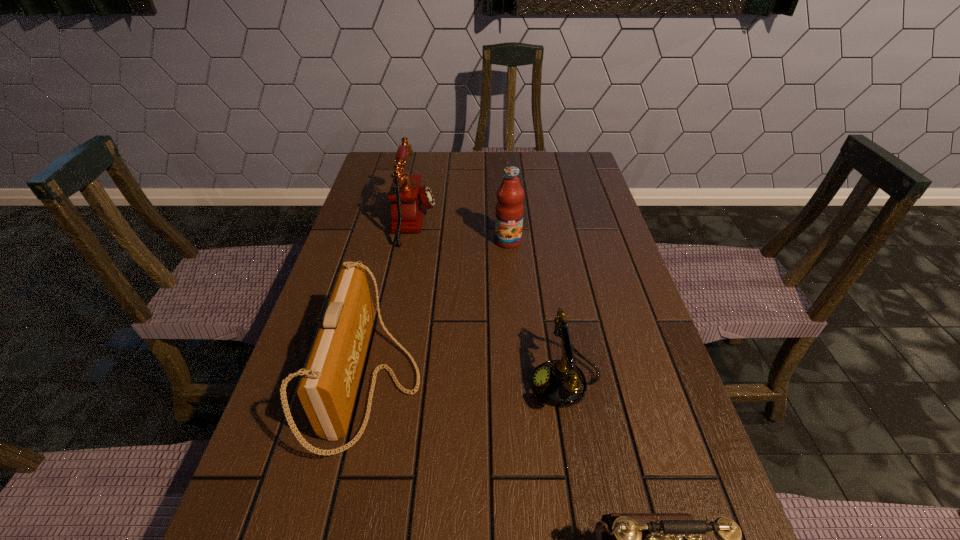
Locate an element on the screen. The height and width of the screenshot is (540, 960). vacant point located between the second farthest telephone and the farthest telephone is located at coordinates (490, 302).

The image size is (960, 540). I want to click on free point between the handbag and the second nearest telephone, so click(x=468, y=382).

Identify which object is located as the nearest to the second nearest telephone. Please provide its 2D coordinates. Your answer should be formatted as a tuple, i.e. [(x, y)], where the tuple contains the x and y coordinates of a point satisfying the conditions above.

[(635, 539)]

Identify which object is located as the second nearest to the nearest telephone. Please provide its 2D coordinates. Your answer should be formatted as a tuple, i.e. [(x, y)], where the tuple contains the x and y coordinates of a point satisfying the conditions above.

[(327, 389)]

Find the location of a particular element. The width and height of the screenshot is (960, 540). telephone that can be found as the second closest to the tallest telephone is located at coordinates tap(635, 539).

Select which telephone is the third closest to the fruit juice. Please provide its 2D coordinates. Your answer should be formatted as a tuple, i.e. [(x, y)], where the tuple contains the x and y coordinates of a point satisfying the conditions above.

[(635, 539)]

Identify the location of free spot that satisfies the following two spatial constraints: 1. on the front label of the fruit juice; 2. on the decorative side of the handbag. coord(519,382).